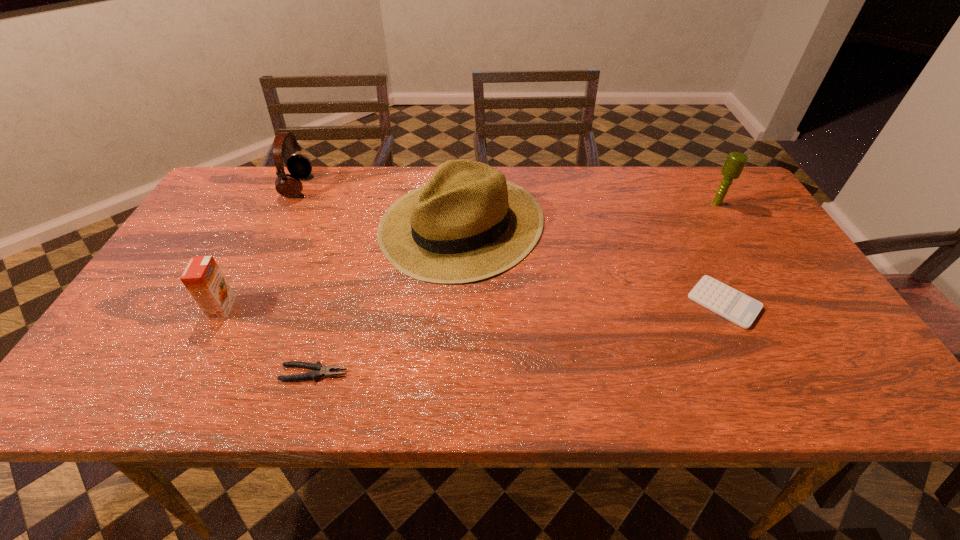
You are a GUI agent. You are given a task and a screenshot of the screen. Output one action in this format:
    pyautogui.click(x=<x>, y=<y>)
    Task: Click on the object that is at the far right corner
    This screenshot has width=960, height=540.
    Given the screenshot: What is the action you would take?
    pyautogui.click(x=735, y=162)

This screenshot has width=960, height=540. In the image, there is a desktop. Find the location of `free space at the far edge`. free space at the far edge is located at coordinates (669, 180).

Locate an element on the screen. vacant space at the near edge of the desktop is located at coordinates (540, 396).

This screenshot has height=540, width=960. In order to click on vacant point at the right edge in this screenshot , I will do `click(820, 347)`.

In the image, there is a desktop. In order to click on free space at the far left corner in this screenshot , I will do `click(209, 210)`.

You are a GUI agent. You are given a task and a screenshot of the screen. Output one action in this format:
    pyautogui.click(x=<x>, y=<y>)
    Task: Click on the free spot between the sunhat and the shortest object
    This screenshot has width=960, height=540.
    Given the screenshot: What is the action you would take?
    pyautogui.click(x=593, y=264)

This screenshot has height=540, width=960. What are the coordinates of `vacant space in between the third shortest object and the sunhat` in the screenshot? It's located at (342, 266).

This screenshot has width=960, height=540. I want to click on free space between the pliers and the sunhat, so click(x=388, y=299).

At what (x,y) coordinates should I click in order to perform the action: click on vacant area between the second object from right to left and the microphone. Please return your answer as a coordinate pair (x, y). This screenshot has height=540, width=960. Looking at the image, I should click on (721, 253).

Image resolution: width=960 pixels, height=540 pixels. I want to click on free space between the sunhat and the microphone, so click(x=589, y=214).